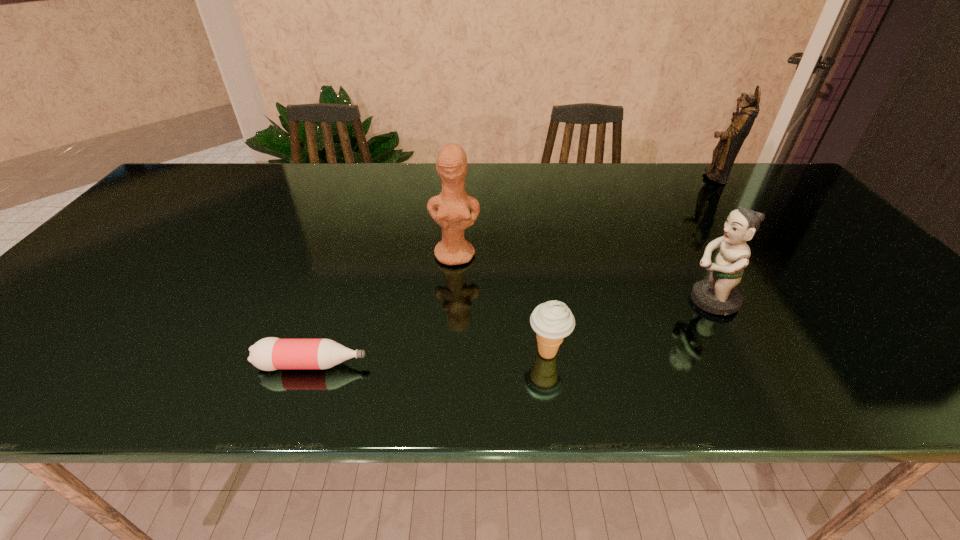
This screenshot has height=540, width=960. Identify the location of vacant area located on the front-facing side of the rightmost object. (675, 178).

The width and height of the screenshot is (960, 540). What are the coordinates of `vacant space positioned on the front-facing side of the rightmost object` in the screenshot? It's located at (657, 178).

At what (x,y) coordinates should I click in order to perform the action: click on free space located on the front-facing side of the rightmost object. Please return your answer as a coordinate pair (x, y). Looking at the image, I should click on (653, 178).

Identify the location of vacant region located on the front-facing side of the leftmost figurine. (449, 349).

Where is `free space located 0.070m on the front-facing side of the fourth object from left to right`? free space located 0.070m on the front-facing side of the fourth object from left to right is located at coordinates (654, 301).

Locate an element on the screen. vacant space located 0.220m on the front-facing side of the fourth object from left to right is located at coordinates pyautogui.click(x=588, y=301).

Image resolution: width=960 pixels, height=540 pixels. In order to click on free region located 0.100m on the front-facing side of the fourth object from left to right in this screenshot , I will do `click(641, 301)`.

At what (x,y) coordinates should I click in order to perform the action: click on vacant space located on the right of the icecream. Please return your answer as a coordinate pair (x, y). Looking at the image, I should click on (697, 353).

Where is `vacant region located with the cap open on the leftmost object`? This screenshot has height=540, width=960. vacant region located with the cap open on the leftmost object is located at coordinates (444, 364).

The image size is (960, 540). Identify the location of object at the far edge. (724, 154).